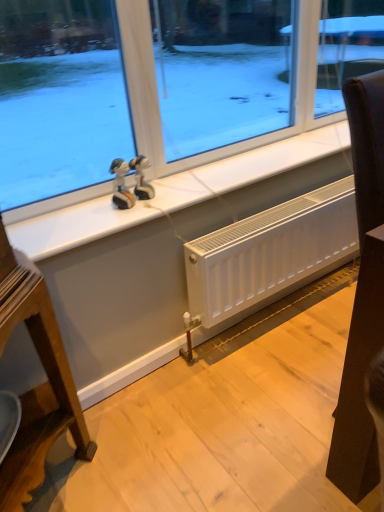
Image resolution: width=384 pixels, height=512 pixels. In order to click on vacant space in front of glossy plastic figurine at upper center, which is counted as the first figurine, starting from the right in this screenshot , I will do `click(127, 217)`.